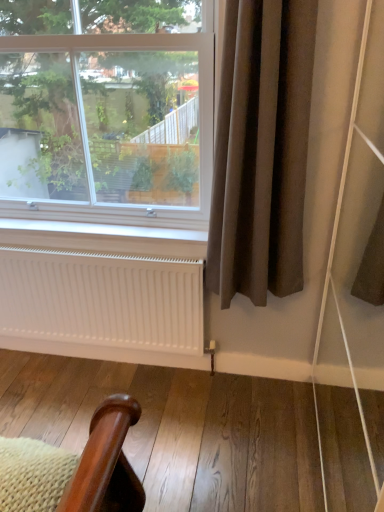
Question: Can you confirm if white matte radiator at lower center is smaller than brown fabric curtain at right?

Choices:
 (A) yes
 (B) no

Answer: (A)

Question: Would you say brown fabric curtain at right is part of white matte radiator at lower center's contents?

Choices:
 (A) yes
 (B) no

Answer: (B)

Question: Does white matte radiator at lower center touch brown fabric curtain at right?

Choices:
 (A) yes
 (B) no

Answer: (B)

Question: Can you confirm if white matte radiator at lower center is positioned to the right of brown fabric curtain at right?

Choices:
 (A) yes
 (B) no

Answer: (B)

Question: Is white matte radiator at lower center taller than brown fabric curtain at right?

Choices:
 (A) yes
 (B) no

Answer: (B)

Question: From a real-world perspective, is white matte radiator at lower center physically located above or below clear glass window at upper left?

Choices:
 (A) below
 (B) above

Answer: (A)

Question: Considering the positions of white matte radiator at lower center and clear glass window at upper left in the image, is white matte radiator at lower center bigger or smaller than clear glass window at upper left?

Choices:
 (A) small
 (B) big

Answer: (A)

Question: From the image's perspective, relative to clear glass window at upper left, is white matte radiator at lower center above or below?

Choices:
 (A) below
 (B) above

Answer: (A)

Question: Considering the positions of point (165, 274) and point (76, 173), is point (165, 274) closer or farther from the camera than point (76, 173)?

Choices:
 (A) farther
 (B) closer

Answer: (B)

Question: Is point (31, 287) closer or farther from the camera than point (261, 70)?

Choices:
 (A) farther
 (B) closer

Answer: (A)

Question: Is white matte radiator at lower center bigger or smaller than brown fabric curtain at right?

Choices:
 (A) big
 (B) small

Answer: (B)

Question: In the image, is white matte radiator at lower center on the left side or the right side of brown fabric curtain at right?

Choices:
 (A) left
 (B) right

Answer: (A)

Question: From the image's perspective, is white matte radiator at lower center located above or below brown fabric curtain at right?

Choices:
 (A) above
 (B) below

Answer: (B)

Question: From the image's perspective, is clear glass window at upper left above or below white matte radiator at lower center?

Choices:
 (A) below
 (B) above

Answer: (B)

Question: Does point pos(201,115) appear closer or farther from the camera than point pos(140,270)?

Choices:
 (A) farther
 (B) closer

Answer: (B)